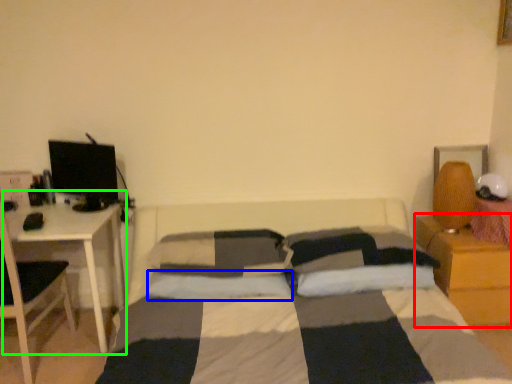
Question: Based on their relative distances, which object is nearer to nightstand (highlighted by a red box)? Choose from pillow (highlighted by a blue box) and table (highlighted by a green box).

Choices:
 (A) pillow
 (B) table

Answer: (A)